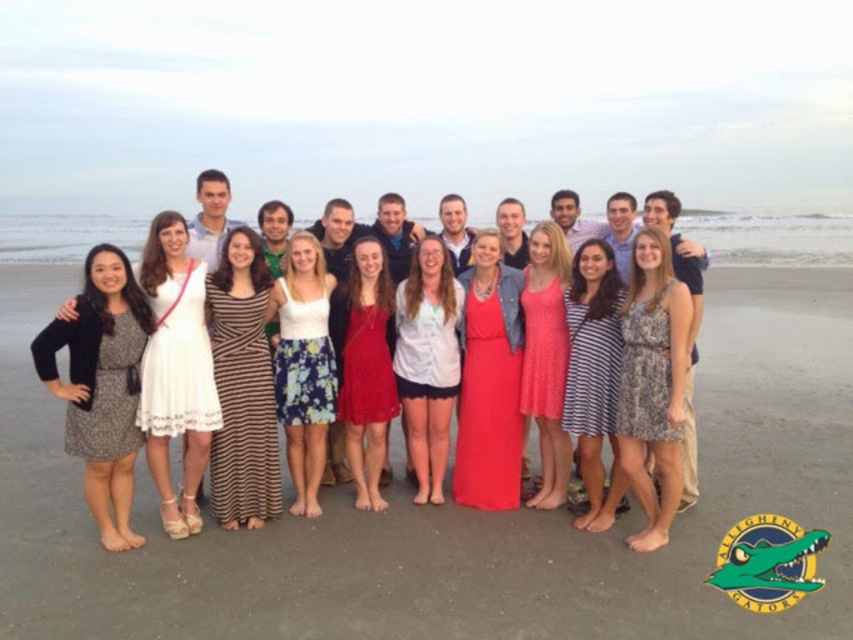
Question: Based on their relative distances, which object is nearer to the brown striped dress at center?

Choices:
 (A) beach sand at center
 (B) striped cotton dress at center
 (C) pink dotted dress at center
 (D) red satin dress at center

Answer: (D)

Question: Observing the image, what is the correct spatial positioning of floral-patterned dress at center in reference to red satin dress at center?

Choices:
 (A) below
 (B) above

Answer: (A)

Question: Which point is closer to the camera?

Choices:
 (A) (445, 333)
 (B) (721, 464)

Answer: (A)

Question: Considering the real-world distances, which object is farthest from the beach sand at center?

Choices:
 (A) matte pink dress at center
 (B) striped cotton dress at center
 (C) white cotton shirt at center
 (D) red satin dress at center

Answer: (B)

Question: Does white floral skirt at center appear over striped cotton dress at center?

Choices:
 (A) yes
 (B) no

Answer: (A)

Question: From the image, what is the correct spatial relationship of beach sand at center in relation to red satin dress at center?

Choices:
 (A) left
 (B) right

Answer: (B)